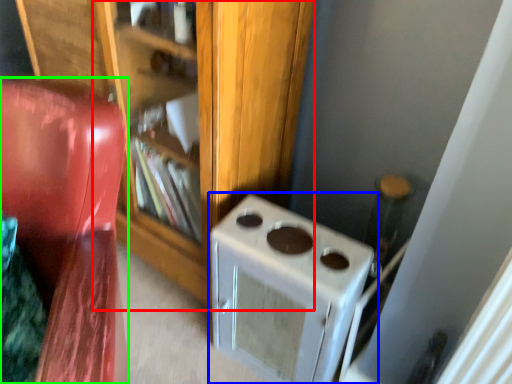
Question: Estimate the real-world distances between objects in this image. Which object is farther from bookshelf (highlighted by a red box), home appliance (highlighted by a blue box) or furniture (highlighted by a green box)?

Choices:
 (A) home appliance
 (B) furniture

Answer: (B)